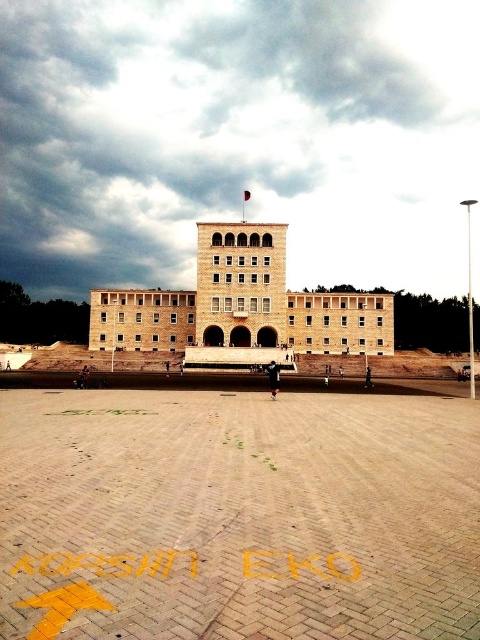
You are standing at the edge of the plaza facing the beige stone building at center and the brown brick tower at center. Which structure is positioned lower in the image?

The beige stone building at center is below the brown brick tower at center, so the beige stone building at center is positioned lower in the image.

You are standing in the plaza in front of the classical building. You notice two points marked on the ground. One is at point coordinates point (268, 291) and the other is point (260, 312). Which point is closer to you?

Point (268, 291) is further to the viewer than point (260, 312), so the point closer to you is point (260, 312).

You are standing in the plaza in front of the beige stone building at center and the brown brick tower at center. You want to place a 1.5 meter wide sculpture between them. Is there enough space?

The beige stone building at center is 6.26 meters away from the brown brick tower at center. Since the sculpture is only 1.5 meters wide, there is plenty of space between them to place it.